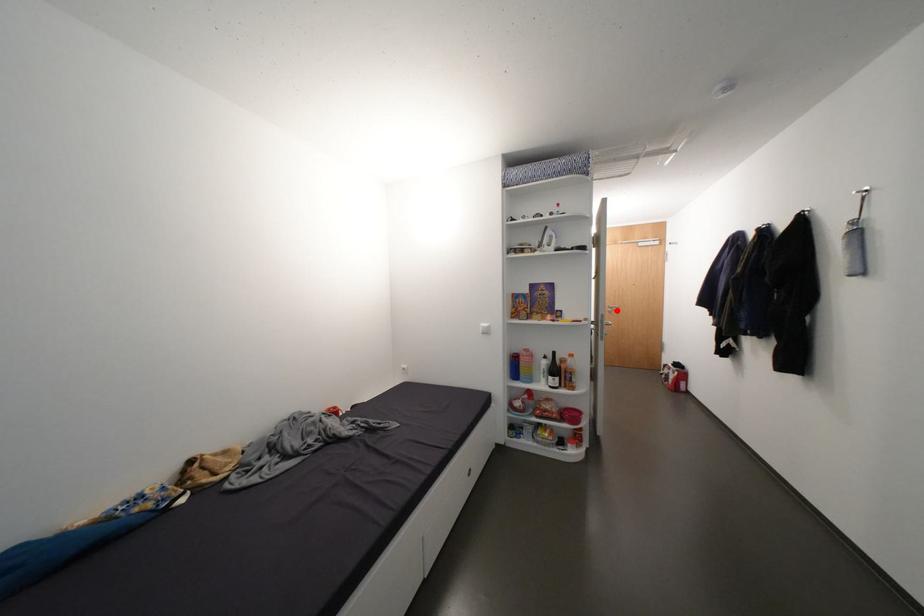
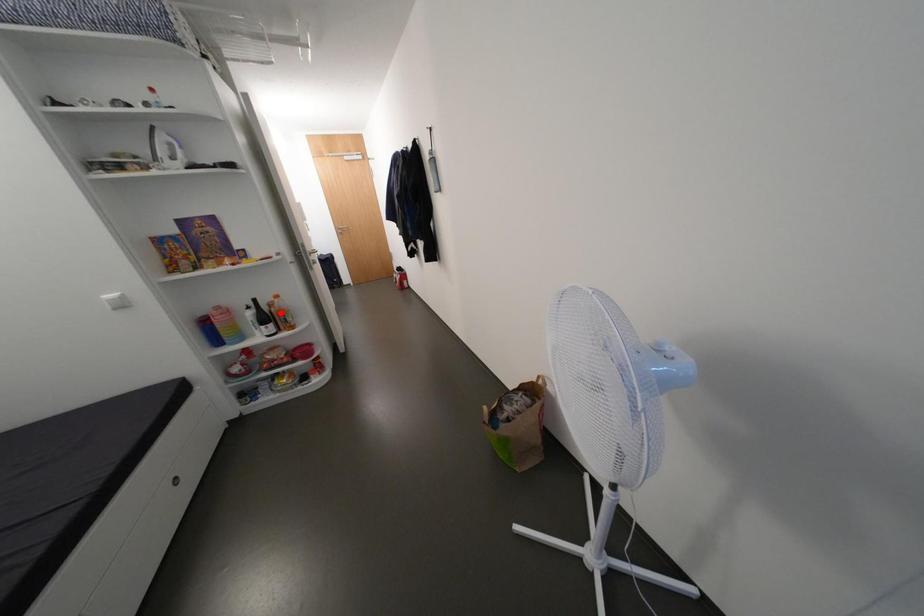
I am providing you with two images of the same scene from different viewpoints. A red point is marked on the first image and another point is marked on the second image. Do the highlighted points in image1 and image2 indicate the same real-world spot?

No